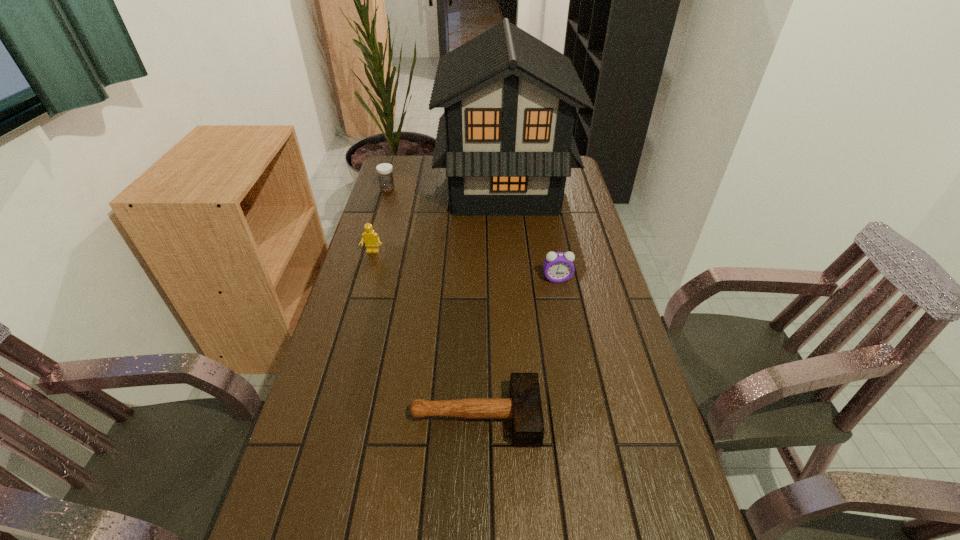
Select which object appears as the second closest to the tallest object. Please provide its 2D coordinates. Your answer should be formatted as a tuple, i.e. [(x, y)], where the tuple contains the x and y coordinates of a point satisfying the conditions above.

[(370, 238)]

Locate an element on the screen. Image resolution: width=960 pixels, height=540 pixels. free location that satisfies the following two spatial constraints: 1. on the face of the alarm clock; 2. on the hammer head face of the nearest object is located at coordinates (584, 416).